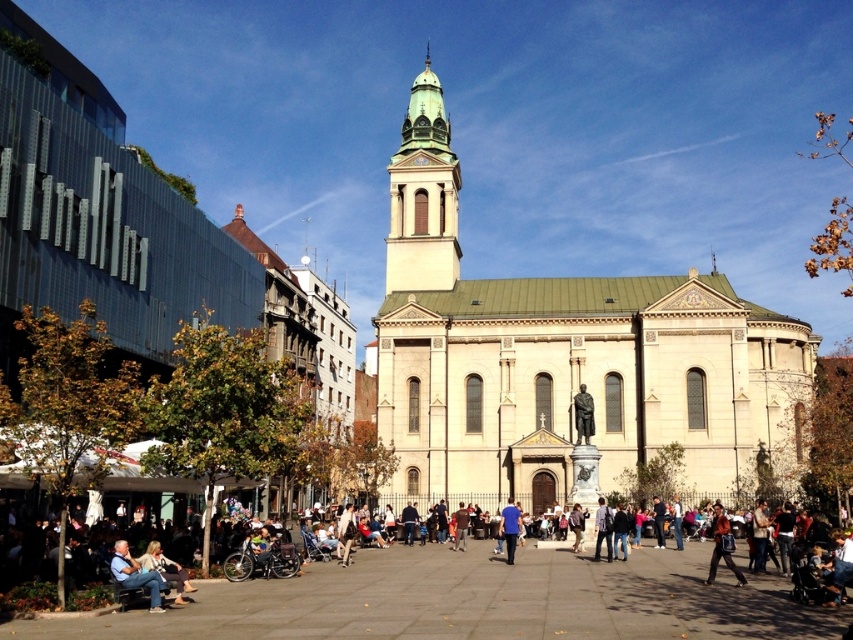
Question: Can you confirm if beige stone church at center is positioned above blue fabric shirt at center?

Choices:
 (A) yes
 (B) no

Answer: (A)

Question: Which object is positioned farthest from the green stone tower at center?

Choices:
 (A) light brown leather bench at lower left
 (B) light brown leather jacket at center

Answer: (A)

Question: Which object is positioned farthest from the leather jacket at lower right?

Choices:
 (A) blue fabric shirt at center
 (B) beige stone church at center
 (C) light brown leather jacket at center
 (D) bronze statue at center

Answer: (B)

Question: Does beige stone church at center appear on the left side of leather jacket at lower right?

Choices:
 (A) no
 (B) yes

Answer: (A)

Question: Where is leather jacket at lower right located in relation to light brown leather jacket at center in the image?

Choices:
 (A) left
 (B) right

Answer: (B)

Question: Which of these objects is positioned farthest from the green stone tower at center?

Choices:
 (A) beige stone church at center
 (B) light brown leather bench at lower left

Answer: (B)